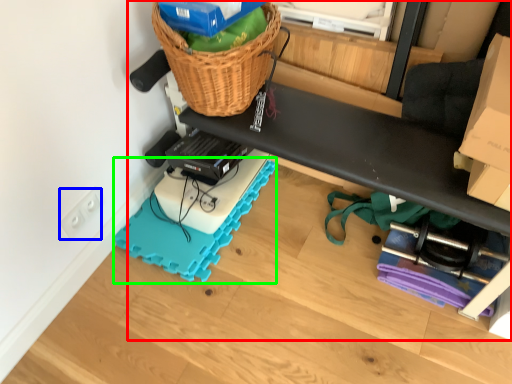
Question: Considering the real-world distances, which object is closest to furniture (highlighted by a red box)? electric outlet (highlighted by a blue box) or yoga mat (highlighted by a green box).

Choices:
 (A) electric outlet
 (B) yoga mat

Answer: (B)